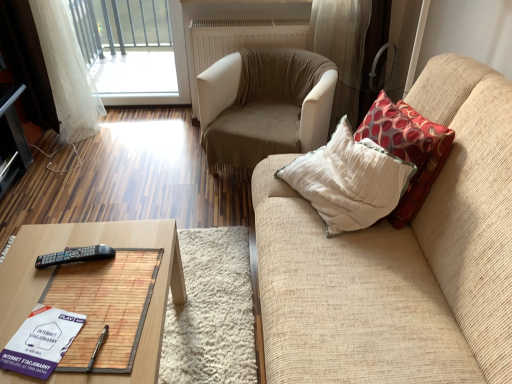
I want to click on empty space that is in between black plastic remote at lower left and purple paper book at lower left, so click(x=60, y=296).